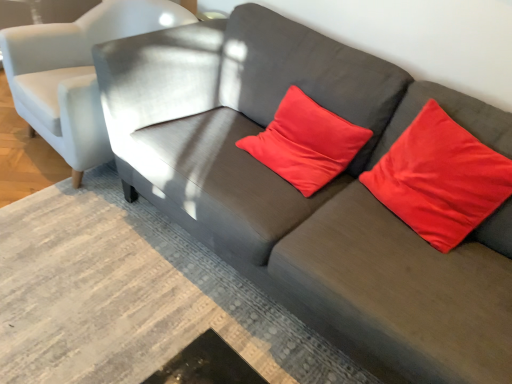
Question: Which direction should I rotate to look at satin red pillow at center, placed as the 2th pillow when sorted from right to left, — up or down?

Choices:
 (A) down
 (B) up

Answer: (B)

Question: Could you tell me if light gray fabric chair at upper left is turned towards satin red pillow at center, placed as the 2th pillow when sorted from right to left?

Choices:
 (A) yes
 (B) no

Answer: (B)

Question: Can you confirm if light gray fabric chair at upper left is positioned to the right of satin red pillow at center, placed as the 2th pillow when sorted from right to left?

Choices:
 (A) no
 (B) yes

Answer: (A)

Question: From a real-world perspective, is light gray fabric chair at upper left physically below satin red pillow at center, which is the first pillow from left to right?

Choices:
 (A) no
 (B) yes

Answer: (B)

Question: Is light gray fabric chair at upper left further to camera compared to satin red pillow at center, which is the first pillow from left to right?

Choices:
 (A) yes
 (B) no

Answer: (A)

Question: From a real-world perspective, is light gray fabric chair at upper left on top of satin red pillow at center, which is the first pillow from left to right?

Choices:
 (A) yes
 (B) no

Answer: (B)

Question: Is light gray fabric chair at upper left at the left side of satin red pillow at center, which is the first pillow from left to right?

Choices:
 (A) no
 (B) yes

Answer: (B)

Question: Considering the relative sizes of satin red pillow at upper right, acting as the first pillow starting from the right, and satin red pillow at center, placed as the 2th pillow when sorted from right to left, in the image provided, is satin red pillow at upper right, acting as the first pillow starting from the right, taller than satin red pillow at center, placed as the 2th pillow when sorted from right to left,?

Choices:
 (A) no
 (B) yes

Answer: (B)

Question: Is satin red pillow at upper right, acting as the first pillow starting from the right, far from satin red pillow at center, which is the first pillow from left to right?

Choices:
 (A) no
 (B) yes

Answer: (A)

Question: Is satin red pillow at upper right, placed as the second pillow when sorted from left to right, smaller than satin red pillow at center, placed as the 2th pillow when sorted from right to left?

Choices:
 (A) no
 (B) yes

Answer: (B)

Question: Is the position of satin red pillow at upper right, acting as the first pillow starting from the right, less distant than that of satin red pillow at center, placed as the 2th pillow when sorted from right to left?

Choices:
 (A) yes
 (B) no

Answer: (A)

Question: Is satin red pillow at upper right, placed as the second pillow when sorted from left to right, at the right side of satin red pillow at center, which is the first pillow from left to right?

Choices:
 (A) no
 (B) yes

Answer: (B)

Question: Is satin red pillow at upper right, acting as the first pillow starting from the right, further to the viewer compared to satin red pillow at center, which is the first pillow from left to right?

Choices:
 (A) yes
 (B) no

Answer: (B)

Question: Does satin red pillow at upper right, acting as the first pillow starting from the right, have a greater width compared to light gray fabric chair at upper left?

Choices:
 (A) no
 (B) yes

Answer: (A)